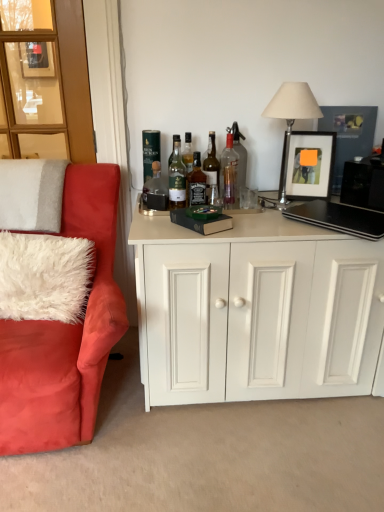
What do you see at coordinates (150, 151) in the screenshot? I see `green glass bottle at upper center, which is counted as the 1th bottle, starting from the left` at bounding box center [150, 151].

This screenshot has width=384, height=512. Identify the location of clear glass bottle at center, which is counted as the 7th bottle, starting from the left. (239, 156).

In order to face velvet red armchair at left, should I rotate leftwards or rightwards?

To face it directly, rotate left by 19.808 degrees.

What do you see at coordinates (75, 79) in the screenshot?
I see `wooden glass door at upper left` at bounding box center [75, 79].

At what (x,y) coordinates should I click in order to perform the action: click on black matte laptop at right. Please return your answer as a coordinate pair (x, y). Looking at the image, I should click on (339, 218).

Does green glass bottle at center, which appears as the 5th bottle when viewed from the right, turn towards green glass bottle at upper center, which is counted as the 1th bottle, starting from the left?

No.

Which is behind, green glass bottle at center, which appears as the 5th bottle when viewed from the right, or green glass bottle at upper center, which is counted as the 1th bottle, starting from the left?

green glass bottle at upper center, which is counted as the 1th bottle, starting from the left, is further from the camera.

Between green glass bottle at center, which appears as the 5th bottle when viewed from the right, and green glass bottle at upper center, which is counted as the 1th bottle, starting from the left, which one has larger width?

With larger width is green glass bottle at center, which appears as the 5th bottle when viewed from the right.

Considering the sizes of objects green glass bottle at center, the 3th bottle positioned from the left, and green glass bottle at upper center, which is counted as the 1th bottle, starting from the left, in the image provided, who is bigger, green glass bottle at center, the 3th bottle positioned from the left, or green glass bottle at upper center, which is counted as the 1th bottle, starting from the left,?

green glass bottle at center, the 3th bottle positioned from the left, is bigger.

Does point (339, 186) lie behind point (146, 184)?

No, (339, 186) is in front of (146, 184).

Between matte black picture frame at upper right and matte glass bottle at center, which appears as the second bottle when viewed from the left, which one appears on the right side from the viewer's perspective?

matte black picture frame at upper right is more to the right.

Is matte black picture frame at upper right not inside matte glass bottle at center, which appears as the second bottle when viewed from the left?

That's correct, matte black picture frame at upper right is outside of matte glass bottle at center, which appears as the second bottle when viewed from the left.

From a real-world perspective, is green glass bottle at upper center, the seventh bottle in the right-to-left sequence, positioned above or below translucent glass bottle at center, the third bottle in the right-to-left sequence?

In terms of real-world spatial position, green glass bottle at upper center, the seventh bottle in the right-to-left sequence, is above translucent glass bottle at center, the third bottle in the right-to-left sequence.

Is green glass bottle at upper center, the seventh bottle in the right-to-left sequence, positioned far away from translucent glass bottle at center, which appears as the 5th bottle when viewed from the left?

green glass bottle at upper center, the seventh bottle in the right-to-left sequence, is near translucent glass bottle at center, which appears as the 5th bottle when viewed from the left, not far away.

Locate an element on the screen. This screenshot has height=512, width=384. the 3rd bottle in front when counting from the green glass bottle at upper center, the seventh bottle in the right-to-left sequence is located at coordinates (211, 167).

Considering the relative sizes of green glass bottle at upper center, the seventh bottle in the right-to-left sequence, and translucent glass bottle at center, the third bottle in the right-to-left sequence, in the image provided, is green glass bottle at upper center, the seventh bottle in the right-to-left sequence, shorter than translucent glass bottle at center, the third bottle in the right-to-left sequence,?

Yes, green glass bottle at upper center, the seventh bottle in the right-to-left sequence, is shorter than translucent glass bottle at center, the third bottle in the right-to-left sequence.

Does green glass bottle at center, which appears as the 5th bottle when viewed from the right, turn towards translucent glass bottle at center, which appears as the 5th bottle when viewed from the left?

No.

Based on their sizes in the image, would you say green glass bottle at center, which appears as the 5th bottle when viewed from the right, is bigger or smaller than translucent glass bottle at center, the third bottle in the right-to-left sequence?

Clearly, green glass bottle at center, which appears as the 5th bottle when viewed from the right, is larger in size than translucent glass bottle at center, the third bottle in the right-to-left sequence.

I want to click on bottle that is the 1st object located below the translucent glass bottle at center, the third bottle in the right-to-left sequence (from the image's perspective), so click(x=177, y=177).

From the image's perspective, which is above, green glass bottle at center, the 3th bottle positioned from the left, or translucent glass bottle at center, which appears as the 5th bottle when viewed from the left?

From the image's view, translucent glass bottle at center, which appears as the 5th bottle when viewed from the left, is above.

Considering the sizes of clear glass bottle at center, acting as the 6th bottle starting from the left, and matte black picture frame at upper right in the image, is clear glass bottle at center, acting as the 6th bottle starting from the left, wider or thinner than matte black picture frame at upper right?

Considering their sizes, clear glass bottle at center, acting as the 6th bottle starting from the left, looks broader than matte black picture frame at upper right.

From the image's perspective, is clear glass bottle at center, acting as the 6th bottle starting from the left, beneath matte black picture frame at upper right?

Indeed, from the image's perspective, clear glass bottle at center, acting as the 6th bottle starting from the left, is shown beneath matte black picture frame at upper right.

Between clear glass bottle at center, acting as the 6th bottle starting from the left, and matte black picture frame at upper right, which one has more height?

matte black picture frame at upper right.

Is clear glass bottle at center, the second bottle positioned from the right, directly adjacent to matte black picture frame at upper right?

A: No, clear glass bottle at center, the second bottle positioned from the right, is not next to matte black picture frame at upper right.

Does point (232, 126) appear closer or farther from the camera than point (80, 147)?

Clearly, point (232, 126) is closer to the camera than point (80, 147).

Which of these two, clear glass bottle at center, placed as the 1th bottle when sorted from right to left, or wooden glass door at upper left, is smaller?

clear glass bottle at center, placed as the 1th bottle when sorted from right to left.

In terms of height, does clear glass bottle at center, which is counted as the 7th bottle, starting from the left, look taller or shorter compared to wooden glass door at upper left?

clear glass bottle at center, which is counted as the 7th bottle, starting from the left, is shorter than wooden glass door at upper left.

Is clear glass bottle at center, which is counted as the 7th bottle, starting from the left, beside wooden glass door at upper left?

No.

Are clear glass bottle at center, which is counted as the 7th bottle, starting from the left, and matte black picture frame at upper right far apart?

Actually, clear glass bottle at center, which is counted as the 7th bottle, starting from the left, and matte black picture frame at upper right are a little close together.

Which is correct: clear glass bottle at center, which is counted as the 7th bottle, starting from the left, is inside matte black picture frame at upper right, or outside of it?

The correct answer is: outside.

Considering the relative sizes of clear glass bottle at center, placed as the 1th bottle when sorted from right to left, and matte black picture frame at upper right in the image provided, is clear glass bottle at center, placed as the 1th bottle when sorted from right to left, bigger than matte black picture frame at upper right?

Incorrect, clear glass bottle at center, placed as the 1th bottle when sorted from right to left, is not larger than matte black picture frame at upper right.

I want to click on bottle that is the 6th object located behind the green glass bottle at center, the 3th bottle positioned from the left, so click(x=150, y=151).

Locate an element on the screen. the 6th bottle to the left when counting from the matte black picture frame at upper right is located at coordinates (156, 190).

Considering their positions, is wooden glass door at upper left positioned further to velvet red armchair at left than green glass bottle at center, which appears as the 5th bottle when viewed from the right?

Based on the image, wooden glass door at upper left appears to be further to velvet red armchair at left.

Looking at this image, looking at the image, which one is located further to green glass bottle at upper center, the seventh bottle in the right-to-left sequence, translucent glass bottle at center, the fourth bottle viewed from the right, or velvet red armchair at left?

Based on the image, velvet red armchair at left appears to be further to green glass bottle at upper center, the seventh bottle in the right-to-left sequence.

From the picture: When comparing their distances from matte glass bottle at center, which appears as the second bottle when viewed from the left, does velvet red armchair at left or matte black picture frame at upper right seem further?

Among the two, matte black picture frame at upper right is located further to matte glass bottle at center, which appears as the second bottle when viewed from the left.

Looking at the image, which one is located further to white fluffy pillow at left, which is counted as the 1th pillow, starting from the top, translucent glass bottle at center, the third bottle in the right-to-left sequence, or green glass bottle at upper center, the seventh bottle in the right-to-left sequence?

The object further to white fluffy pillow at left, which is counted as the 1th pillow, starting from the top, is translucent glass bottle at center, the third bottle in the right-to-left sequence.

Looking at the image, which one is located closer to velvet red armchair at left, black matte laptop at right or translucent glass bottle at center, acting as the fourth bottle starting from the left?

translucent glass bottle at center, acting as the fourth bottle starting from the left.

Considering their positions, is black matte laptop at right positioned closer to matte black picture frame at upper right than translucent glass bottle at center, the third bottle in the right-to-left sequence?

The object closer to matte black picture frame at upper right is black matte laptop at right.

From the picture: Looking at the image, which one is located closer to green glass bottle at center, the 3th bottle positioned from the left, matte glass bottle at center, the sixth bottle positioned from the right, or metallic silver table lamp at upper right?

matte glass bottle at center, the sixth bottle positioned from the right, is positioned closer to the anchor green glass bottle at center, the 3th bottle positioned from the left.

From the image, which object appears to be nearer to velvet red armchair at left, metallic silver table lamp at upper right or black matte laptop at right?

black matte laptop at right is closer to velvet red armchair at left.

Image resolution: width=384 pixels, height=512 pixels. In order to click on pillow located between white fluffy pillow at left, positioned as the 2th pillow in bottom-to-top order, and green glass bottle at upper center, which is counted as the 1th bottle, starting from the left, in the left-right direction in this screenshot , I will do `click(45, 276)`.

Identify the location of table lamp between green glass bottle at upper center, the seventh bottle in the right-to-left sequence, and black matte laptop at right, in the horizontal direction. The height and width of the screenshot is (512, 384). (291, 116).

Where is `table lamp between wooden glass door at upper left and matte black picture frame at upper right in the horizontal direction`? table lamp between wooden glass door at upper left and matte black picture frame at upper right in the horizontal direction is located at coordinates (291, 116).

This screenshot has height=512, width=384. Find the location of `table lamp between white fluffy pillow at left, positioned as the 2th pillow in top-to-bottom order, and black matte laptop at right from left to right`. table lamp between white fluffy pillow at left, positioned as the 2th pillow in top-to-bottom order, and black matte laptop at right from left to right is located at coordinates (291, 116).